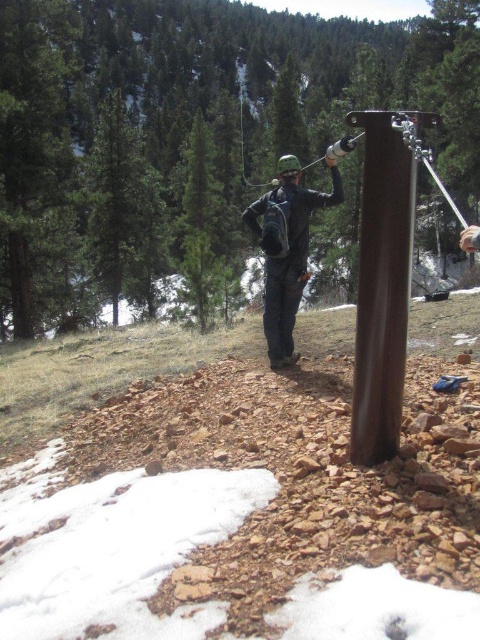
Question: Does matte black backpack at center appear on the left side of metallic silver ski pole at upper center?

Choices:
 (A) yes
 (B) no

Answer: (A)

Question: Which object is closer to the camera taking this photo?

Choices:
 (A) brown metallic post at center
 (B) metallic silver ski pole at upper center
 (C) matte black backpack at center

Answer: (A)

Question: Which object is the farthest from the matte black backpack at center?

Choices:
 (A) brown metallic post at center
 (B) metallic silver ski pole at upper center

Answer: (B)

Question: Does matte black backpack at center appear on the left side of metallic silver ski pole at upper center?

Choices:
 (A) no
 (B) yes

Answer: (B)

Question: Is matte black backpack at center in front of metallic silver ski pole at upper center?

Choices:
 (A) yes
 (B) no

Answer: (B)

Question: Estimate the real-world distances between objects in this image. Which object is farther from the brown metallic post at center?

Choices:
 (A) matte black backpack at center
 (B) metallic silver ski pole at upper center

Answer: (B)